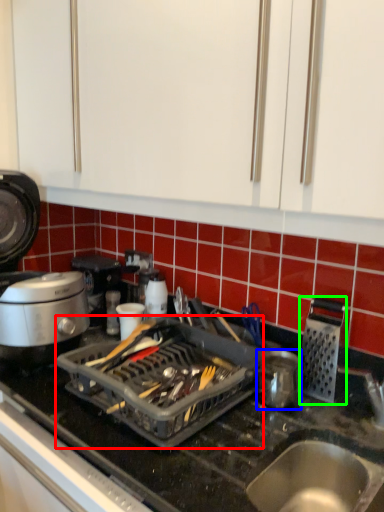
Question: Considering the real-world distances, which object is farthest from appliance (highlighted by a red box)? kitchen appliance (highlighted by a blue box) or kitchen appliance (highlighted by a green box)?

Choices:
 (A) kitchen appliance
 (B) kitchen appliance

Answer: (B)